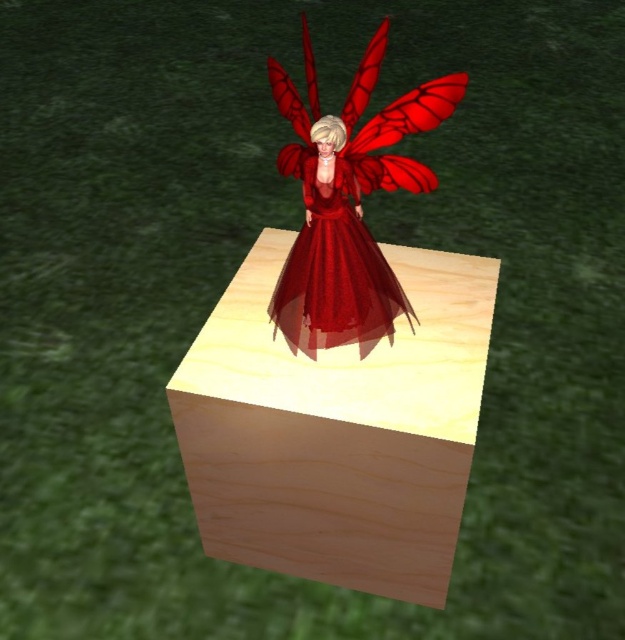
From the picture: You are an artist trying to paint this scene. You want to ensure the wooden cube at center and shiny red dress at center are proportionally accurate. Which object should you paint first to maintain the correct size relationship between them?

You should paint the wooden cube at center first since it is larger than the shiny red dress at center, allowing you to establish the scale before adding smaller details.

Based on the scene description, where is the wooden cube at center located relative to the shiny red dress at center?

The wooden cube at center is to the left of the shiny red dress at center.

You are a photographer setting up a shot of the fairy on the wooden block. You need to place a small light exactly at the point marked as point (226, 499). The light must be placed 1.5 meters away from the camera to ensure proper lighting. Will the light be placed at the correct distance if you put it at that point?

The point (226, 499) is 1.57 meters from the camera. Since 1.57 meters is slightly more than 1.5 meters, the light will be placed slightly farther away than required. Adjust the position to reduce the distance by 0.07 meters for accurate placement.